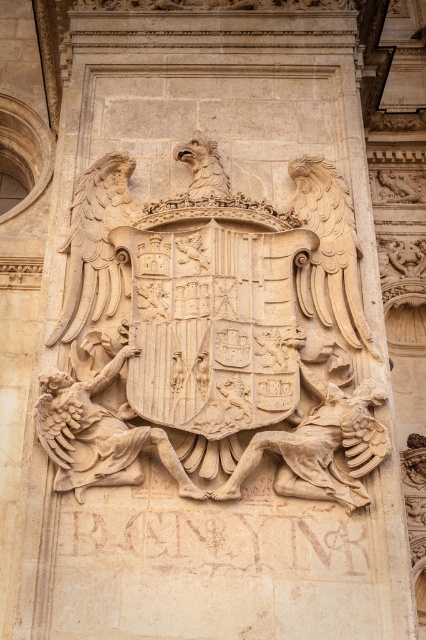
Is beige stone warrior at center below beige stone figure at center?

Actually, beige stone warrior at center is above beige stone figure at center.

Can you confirm if beige stone warrior at center is smaller than beige stone figure at center?

Actually, beige stone warrior at center might be larger than beige stone figure at center.

The height and width of the screenshot is (640, 426). In order to click on beige stone warrior at center in this screenshot , I will do `click(97, 433)`.

Is carved stone coat of arms at center positioned in front of beige stone figure at center?

No.

Is carved stone coat of arms at center to the right of beige stone figure at center from the viewer's perspective?

Incorrect, carved stone coat of arms at center is not on the right side of beige stone figure at center.

Locate an element on the screen. Image resolution: width=426 pixels, height=640 pixels. carved stone coat of arms at center is located at coordinates (213, 336).

Does carved stone coat of arms at center appear over beige stone warrior at center?

Indeed, carved stone coat of arms at center is positioned over beige stone warrior at center.

Who is higher up, carved stone coat of arms at center or beige stone warrior at center?

carved stone coat of arms at center is above.

Between point (158, 340) and point (112, 440), which one is positioned behind?

The point (158, 340) is behind.

Image resolution: width=426 pixels, height=640 pixels. Find the location of `carved stone coat of arms at center`. carved stone coat of arms at center is located at coordinates (213, 336).